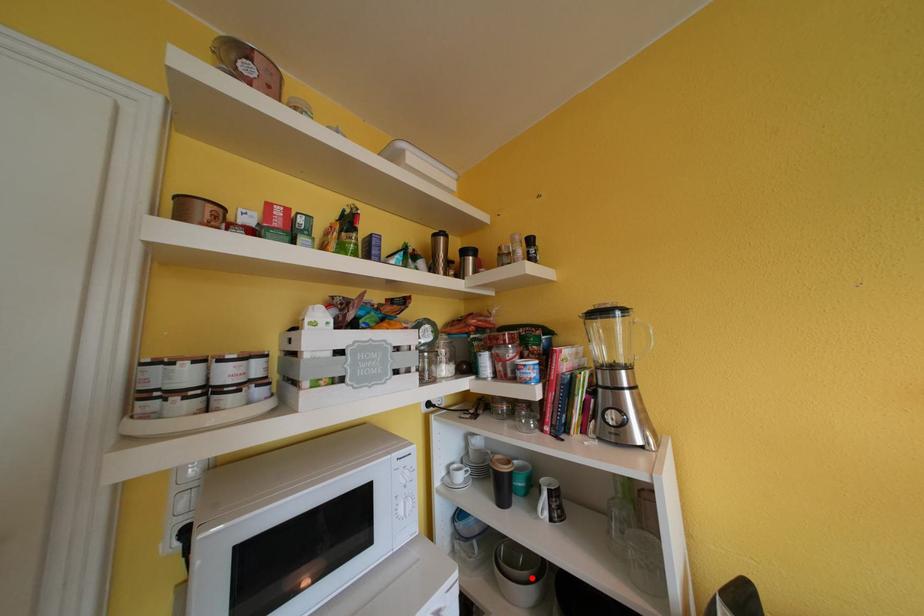
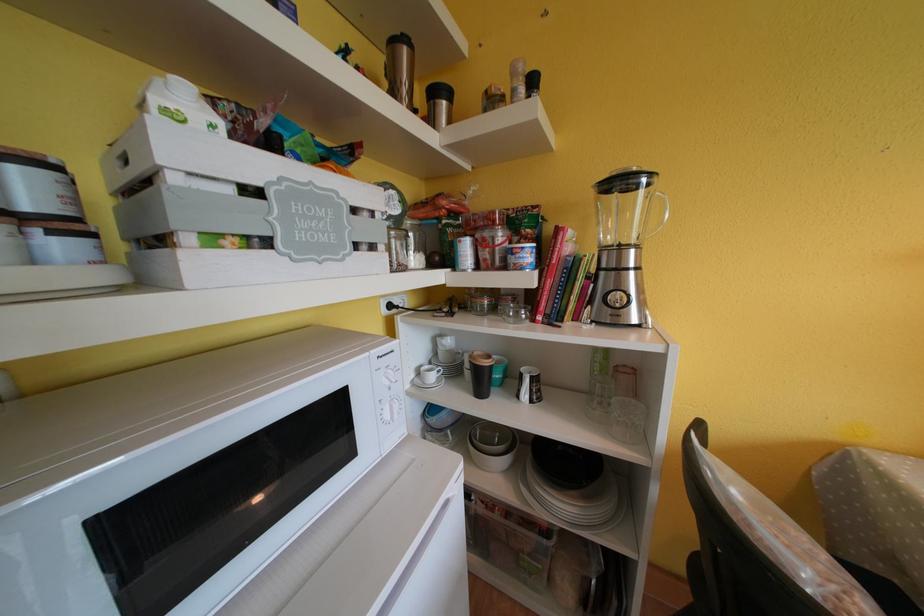
In the second image, find the point that corresponds to the highlighted location in the first image.

(507, 452)